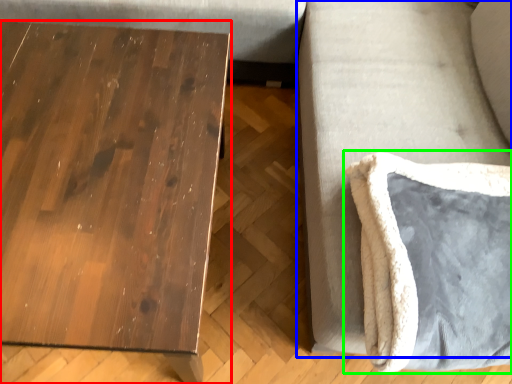
Question: Based on their relative distances, which object is nearer to table (highlighted by a red box)? Choose from couch (highlighted by a blue box) and swivel chair (highlighted by a green box).

Choices:
 (A) couch
 (B) swivel chair

Answer: (A)